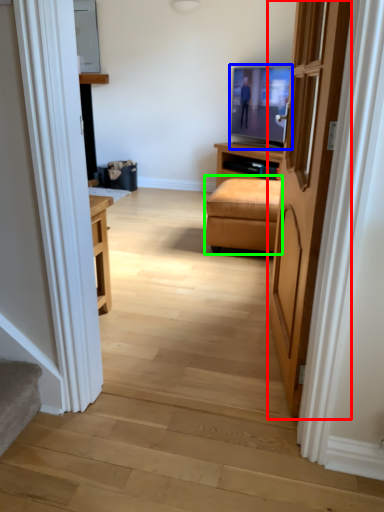
Question: Considering the real-world distances, which object is closest to door (highlighted by a red box)? television (highlighted by a blue box) or studio couch (highlighted by a green box).

Choices:
 (A) television
 (B) studio couch

Answer: (B)